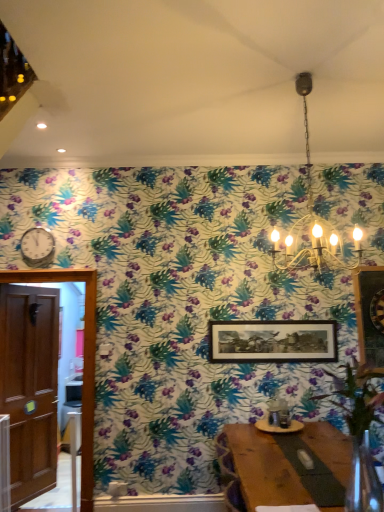
Question: From their relative heights in the image, would you say metallic chandelier at upper center is taller or shorter than metallic silver clock at left?

Choices:
 (A) short
 (B) tall

Answer: (B)

Question: From the image's perspective, is metallic chandelier at upper center located above or below metallic silver clock at left?

Choices:
 (A) below
 (B) above

Answer: (B)

Question: Considering the real-world distances, which object is farthest from the wooden door at left?

Choices:
 (A) metallic chandelier at upper center
 (B) wooden framed picture at center
 (C) metallic silver clock at left

Answer: (A)

Question: Estimate the real-world distances between objects in this image. Which object is closer to the metallic chandelier at upper center?

Choices:
 (A) wooden door at left
 (B) metallic silver clock at left
 (C) wooden framed picture at center

Answer: (C)